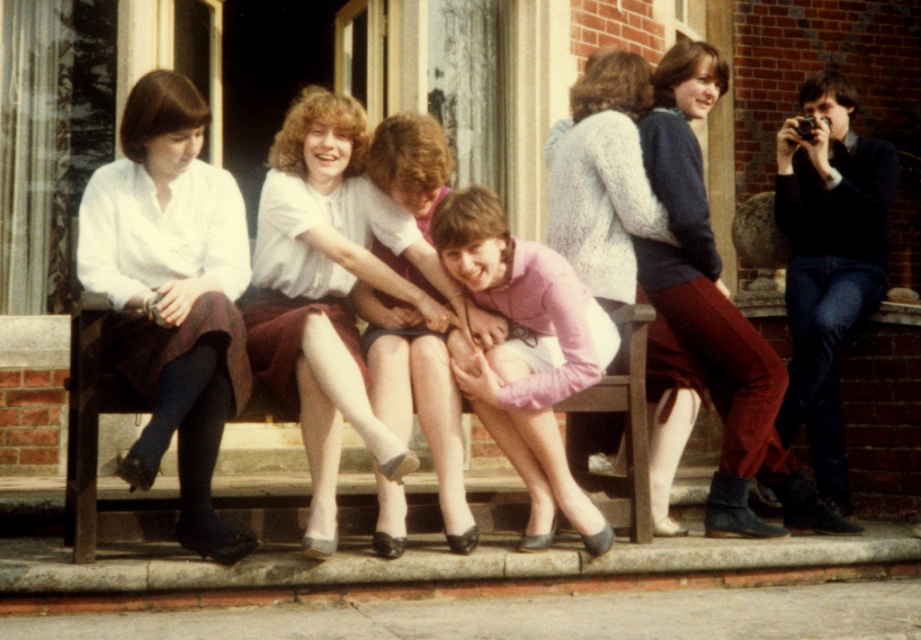
Question: Which point is closer to the camera taking this photo?

Choices:
 (A) (99, 513)
 (B) (183, 292)

Answer: (A)

Question: Is white sheer tights at center to the left of knitted sweater at center from the viewer's perspective?

Choices:
 (A) yes
 (B) no

Answer: (A)

Question: Is matte white blouse at left below knitted sweater at center?

Choices:
 (A) no
 (B) yes

Answer: (B)

Question: Which object appears farthest from the camera in this image?

Choices:
 (A) matte white blouse at center
 (B) pink matte sweater at center

Answer: (B)

Question: Is velvet maroon pants at center bigger than knitted sweater at center?

Choices:
 (A) no
 (B) yes

Answer: (B)

Question: Which point is closer to the camera taking this photo?

Choices:
 (A) (627, 138)
 (B) (450, 371)
 (C) (787, 465)
 (D) (158, 353)

Answer: (D)